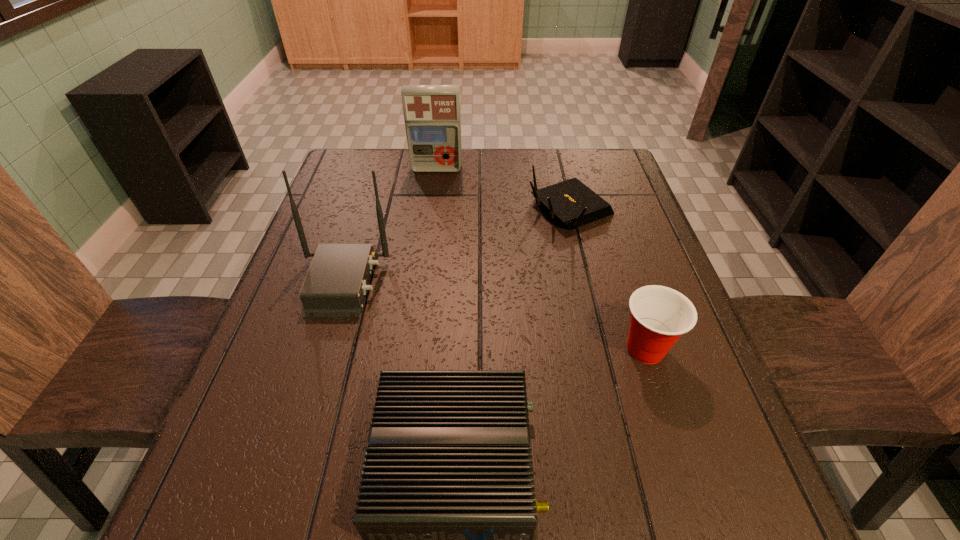
Locate an element on the screen. The height and width of the screenshot is (540, 960). blank space at the right edge is located at coordinates (644, 251).

This screenshot has width=960, height=540. Identify the location of blank space at the far left corner of the desktop. (336, 182).

This screenshot has height=540, width=960. Find the location of `free spot between the cup and the tallest router`. free spot between the cup and the tallest router is located at coordinates (494, 316).

At what (x,y) coordinates should I click in order to perform the action: click on vacant area between the leftmost router and the farthest router. Please return your answer as a coordinate pair (x, y). The image size is (960, 540). Looking at the image, I should click on (456, 246).

The image size is (960, 540). I want to click on empty location between the farthest router and the third tallest object, so click(x=608, y=279).

Locate an element on the screen. The height and width of the screenshot is (540, 960). free spot between the second nearest object and the rightmost router is located at coordinates (608, 279).

What are the coordinates of `free space that is in between the farthest router and the third nearest object` in the screenshot? It's located at (456, 246).

Identify which object is the second nearest to the first-aid kit. Please provide its 2D coordinates. Your answer should be formatted as a tuple, i.e. [(x, y)], where the tuple contains the x and y coordinates of a point satisfying the conditions above.

[(335, 286)]

I want to click on object that is the third closest to the leftmost object, so click(x=432, y=116).

Select which router is the closest to the tallest router. Please provide its 2D coordinates. Your answer should be formatted as a tuple, i.e. [(x, y)], where the tuple contains the x and y coordinates of a point satisfying the conditions above.

[(447, 512)]